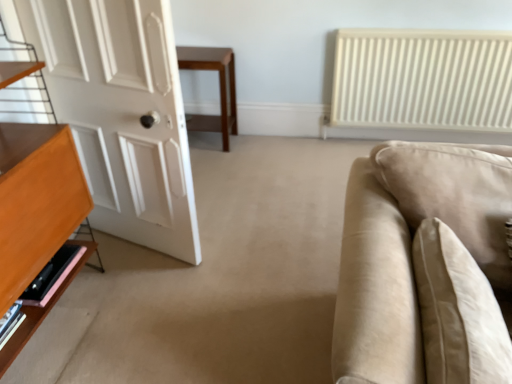
Question: From the image's perspective, is pink wood shelf at lower left beneath wooden table at center?

Choices:
 (A) yes
 (B) no

Answer: (A)

Question: From a real-world perspective, is pink wood shelf at lower left below wooden table at center?

Choices:
 (A) no
 (B) yes

Answer: (B)

Question: Is pink wood shelf at lower left touching wooden table at center?

Choices:
 (A) no
 (B) yes

Answer: (A)

Question: Does pink wood shelf at lower left have a lesser height compared to wooden table at center?

Choices:
 (A) no
 (B) yes

Answer: (B)

Question: From a real-world perspective, is pink wood shelf at lower left physically above wooden table at center?

Choices:
 (A) yes
 (B) no

Answer: (B)

Question: Considering the positions of white matte door at left and beige fabric pillow at right in the image, is white matte door at left wider or thinner than beige fabric pillow at right?

Choices:
 (A) thin
 (B) wide

Answer: (A)

Question: From a real-world perspective, is white matte door at left above or below beige fabric pillow at right?

Choices:
 (A) above
 (B) below

Answer: (A)

Question: From their relative heights in the image, would you say white matte door at left is taller or shorter than beige fabric pillow at right?

Choices:
 (A) short
 (B) tall

Answer: (B)

Question: From the image's perspective, is white matte door at left positioned above or below beige fabric pillow at right?

Choices:
 (A) above
 (B) below

Answer: (A)

Question: From a real-world perspective, is beige fabric pillow at right physically located above or below beige fabric couch at right?

Choices:
 (A) above
 (B) below

Answer: (A)

Question: Is point (488, 364) closer or farther from the camera than point (465, 190)?

Choices:
 (A) closer
 (B) farther

Answer: (A)

Question: Relative to beige fabric couch at right, is beige fabric pillow at right in front or behind?

Choices:
 (A) behind
 (B) front

Answer: (A)

Question: Considering the positions of beige fabric pillow at right and beige fabric couch at right in the image, is beige fabric pillow at right bigger or smaller than beige fabric couch at right?

Choices:
 (A) big
 (B) small

Answer: (B)

Question: Which is correct: beige fabric pillow at right is inside wooden table at center, or outside of it?

Choices:
 (A) inside
 (B) outside

Answer: (B)

Question: From a real-world perspective, is beige fabric pillow at right positioned above or below wooden table at center?

Choices:
 (A) above
 (B) below

Answer: (A)